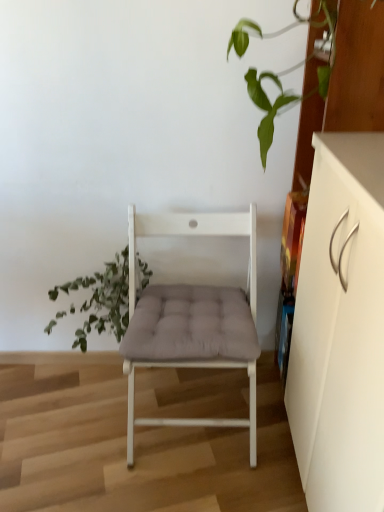
Question: Relative to white matte cabinet at right, is green leafy plant at left in front or behind?

Choices:
 (A) front
 (B) behind

Answer: (B)

Question: In terms of height, does green leafy plant at left look taller or shorter compared to white matte cabinet at right?

Choices:
 (A) tall
 (B) short

Answer: (B)

Question: Considering the real-world distances, which object is farthest from the white matte cabinet at right?

Choices:
 (A) green leafy plant at left
 (B) white matte chair at center

Answer: (A)

Question: Which object is positioned closest to the white matte chair at center?

Choices:
 (A) white matte cabinet at right
 (B) green leafy plant at left

Answer: (B)